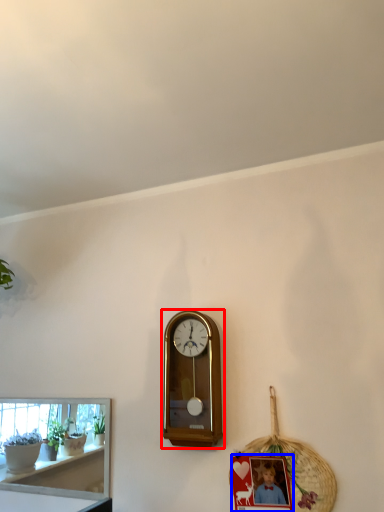
Question: Which object appears farthest to the camera in this image, wall clock (highlighted by a red box) or picture frame (highlighted by a blue box)?

Choices:
 (A) wall clock
 (B) picture frame

Answer: (A)